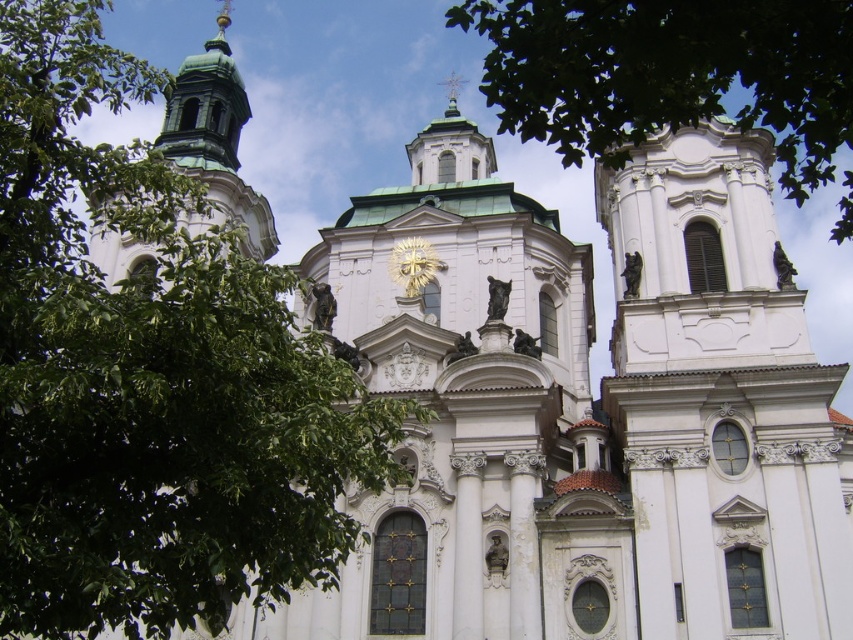
Question: Which is nearer to the green leafy tree at upper left?

Choices:
 (A) gold metallic clock at center
 (B) green polished dome at upper left
 (C) white marble tower at right
 (D) green leafy tree at upper center

Answer: (B)

Question: Which object is the closest to the green leafy tree at upper left?

Choices:
 (A) green polished dome at upper left
 (B) white marble tower at right

Answer: (A)

Question: Can you confirm if green leafy tree at upper left is wider than gold metallic clock at center?

Choices:
 (A) no
 (B) yes

Answer: (B)

Question: Which object is the farthest from the green leafy tree at upper left?

Choices:
 (A) green polished dome at upper left
 (B) white marble tower at right

Answer: (B)

Question: Is green leafy tree at upper left above green polished dome at upper left?

Choices:
 (A) yes
 (B) no

Answer: (B)

Question: Observing the image, what is the correct spatial positioning of green leafy tree at upper left in reference to white marble tower at right?

Choices:
 (A) right
 (B) left

Answer: (B)